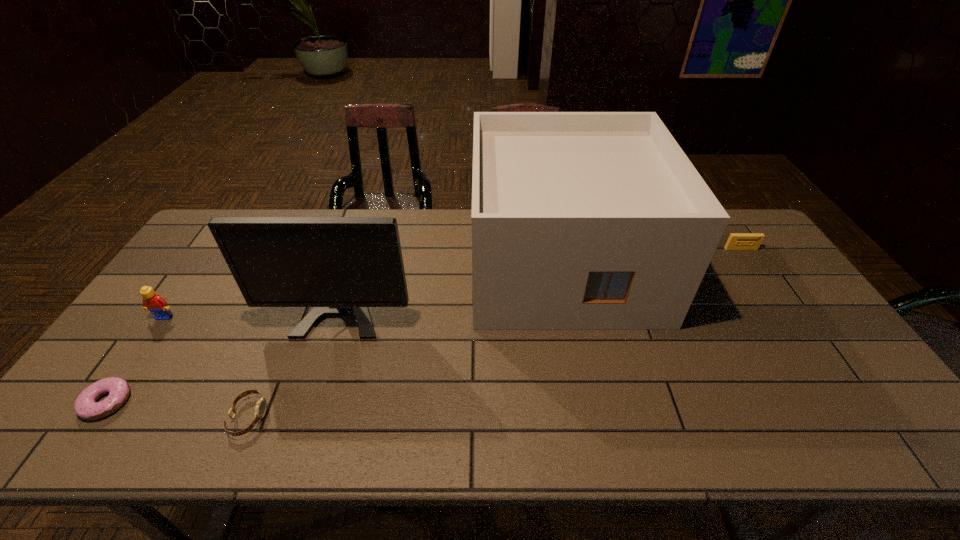
At what (x,y) coordinates should I click in order to perform the action: click on vacant area situated 0.250m at the front of the fourth tallest object with spools. Please return your answer as a coordinate pair (x, y). Looking at the image, I should click on (780, 307).

Identify the location of vacant space situated on the face of the fifth tallest object. The height and width of the screenshot is (540, 960). (378, 417).

The image size is (960, 540). I want to click on blank space located on the right of the doughnut, so click(x=202, y=402).

Image resolution: width=960 pixels, height=540 pixels. In order to click on box that is positioned at the far edge in this screenshot , I will do `click(580, 220)`.

You are a GUI agent. You are given a task and a screenshot of the screen. Output one action in this format:
    pyautogui.click(x=<x>, y=<y>)
    Task: Click on the computer monitor that is at the far edge
    This screenshot has width=960, height=540.
    Given the screenshot: What is the action you would take?
    pyautogui.click(x=340, y=266)

Locate an element on the screen. videotape at the far edge is located at coordinates (737, 241).

Where is `watch positioned at the near edge`? The width and height of the screenshot is (960, 540). watch positioned at the near edge is located at coordinates (260, 409).

The width and height of the screenshot is (960, 540). In order to click on doughnut positioned at the near edge in this screenshot , I will do `click(86, 406)`.

This screenshot has width=960, height=540. In order to click on Lego that is at the left edge in this screenshot , I will do `click(155, 303)`.

This screenshot has width=960, height=540. What are the coordinates of `doughnut at the left edge` in the screenshot? It's located at (86, 406).